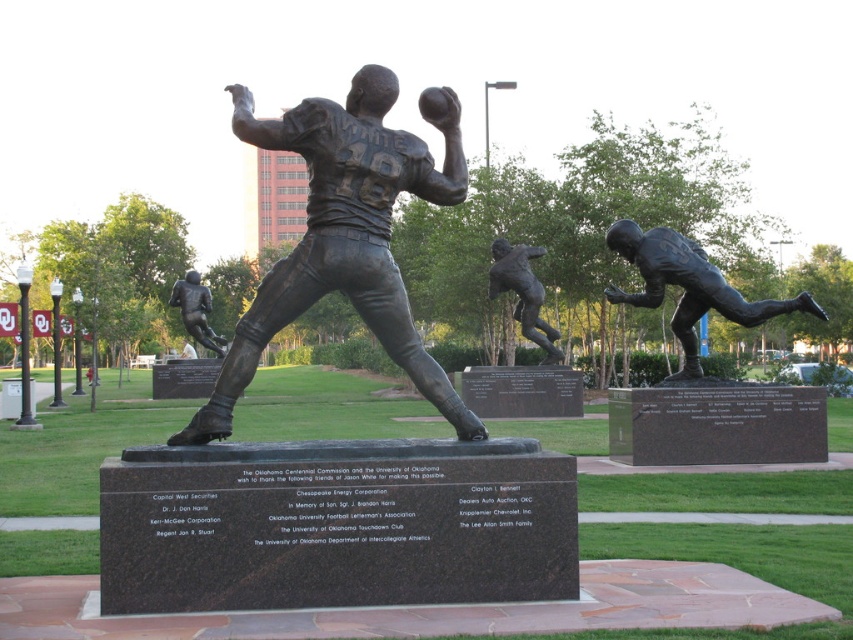
Question: Which object is positioned closest to the bronze statue of a football player at center?

Choices:
 (A) bronze statue at right
 (B) bronze statue at center

Answer: (B)

Question: Which object is positioned farthest from the bronze statue at right?

Choices:
 (A) bronze/statue at center
 (B) bronze statue of a football player at center
 (C) bronze statue at center

Answer: (B)

Question: Does bronze/statue at center have a smaller size compared to bronze statue at right?

Choices:
 (A) no
 (B) yes

Answer: (B)

Question: Which object appears closest to the camera in this image?

Choices:
 (A) bronze statue at right
 (B) bronze statue at center
 (C) bronze statue of a football player at center

Answer: (A)

Question: Is bronze statue at right thinner than bronze statue at center?

Choices:
 (A) no
 (B) yes

Answer: (A)

Question: Is bronze statue at right above bronze statue at center?

Choices:
 (A) no
 (B) yes

Answer: (A)